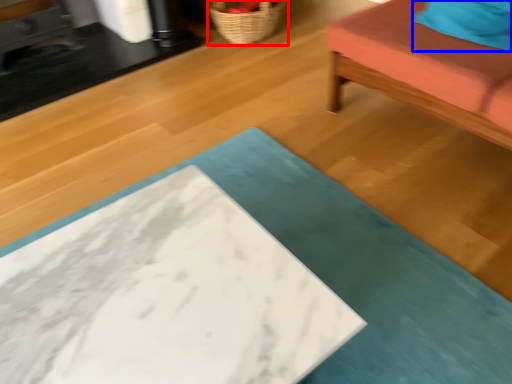
Question: Which object is further to the camera taking this photo, basket (highlighted by a red box) or pillow (highlighted by a blue box)?

Choices:
 (A) basket
 (B) pillow

Answer: (A)